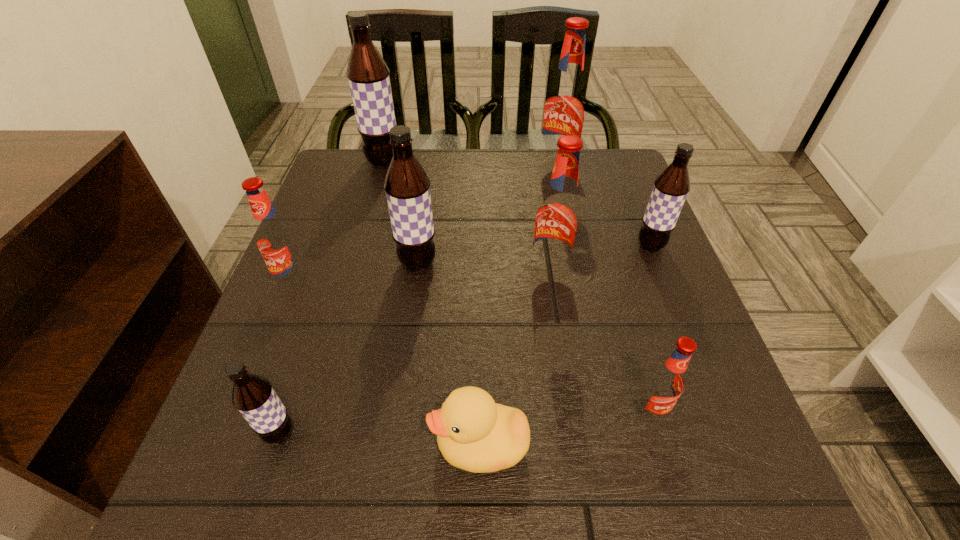
Find the location of a particular element. free space in the image that satisfies the following two spatial constraints: 1. on the back side of the third brown root beer from left to right; 2. on the left side of the farthest red root beer is located at coordinates (431, 168).